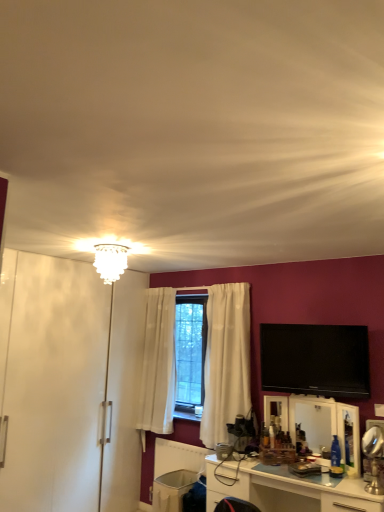
What do you see at coordinates (172, 490) in the screenshot?
I see `white plastic trash bin at lower center` at bounding box center [172, 490].

Describe the element at coordinates (327, 426) in the screenshot. I see `clear glass mirror at center` at that location.

The width and height of the screenshot is (384, 512). What are the coordinates of `clear glass mirror at center` in the screenshot? It's located at 327,426.

What do you see at coordinates (286, 489) in the screenshot? Image resolution: width=384 pixels, height=512 pixels. I see `white glossy cabinet at lower center` at bounding box center [286, 489].

This screenshot has width=384, height=512. I want to click on white glossy cabinet at lower center, so click(286, 489).

You are a GUI agent. You are given a task and a screenshot of the screen. Output one action in this format:
    pyautogui.click(x=<x>, y=<y>)
    Task: Click on the white glossy armoire at left
    
    Given the screenshot: What is the action you would take?
    pyautogui.click(x=54, y=386)

The height and width of the screenshot is (512, 384). What do you see at coordinates (315, 360) in the screenshot?
I see `flat screen tv at upper right` at bounding box center [315, 360].

Image resolution: width=384 pixels, height=512 pixels. What are the coordinates of `white plastic trash bin at lower center` in the screenshot? It's located at (172, 490).

From the picture: Which is more to the left, white glossy cabinet at lower center or flat screen tv at upper right?

From the viewer's perspective, white glossy cabinet at lower center appears more on the left side.

Is white glossy cabinet at lower center closer to the viewer compared to flat screen tv at upper right?

Yes, white glossy cabinet at lower center is closer to the camera.

In the scene shown: Is white glossy cabinet at lower center placed right next to flat screen tv at upper right?

white glossy cabinet at lower center and flat screen tv at upper right are clearly separated.

From the image's perspective, between white glossy cabinet at lower center and flat screen tv at upper right, who is located below?

white glossy cabinet at lower center appears lower in the image.

Consider the image. Can you confirm if white glass chandelier at upper center is positioned to the right of white glossy cabinet at lower center?

In fact, white glass chandelier at upper center is to the left of white glossy cabinet at lower center.

From a real-world perspective, which object stands above the other?

white glass chandelier at upper center.

Would you say white glossy cabinet at lower center is part of white glass chandelier at upper center's contents?

No, white glossy cabinet at lower center is not surrounded by white glass chandelier at upper center.

Who is taller, white glass chandelier at upper center or white glossy cabinet at lower center?

Standing taller between the two is white glossy cabinet at lower center.

Is clear glass mirror at center in front of or behind white glass chandelier at upper center in the image?

clear glass mirror at center is positioned closer to the viewer than white glass chandelier at upper center.

Looking at this image, between clear glass mirror at center and white glass chandelier at upper center, which one has less height?

With less height is white glass chandelier at upper center.

From a real-world perspective, is clear glass mirror at center under white glass chandelier at upper center?

Correct, in the physical world, clear glass mirror at center is lower than white glass chandelier at upper center.

Could you tell me if clear glass mirror at center is turned towards white glass chandelier at upper center?

No, clear glass mirror at center is not oriented towards white glass chandelier at upper center.

Is white glass chandelier at upper center far from clear glass mirror at center?

That's right, there is a large distance between white glass chandelier at upper center and clear glass mirror at center.

Considering the sizes of objects white glass chandelier at upper center and clear glass mirror at center in the image provided, who is bigger, white glass chandelier at upper center or clear glass mirror at center?

With larger size is clear glass mirror at center.

Which of these two, white glass chandelier at upper center or clear glass mirror at center, stands taller?

clear glass mirror at center.

Is white glass chandelier at upper center aimed at clear glass mirror at center?

No, white glass chandelier at upper center is not facing towards clear glass mirror at center.

This screenshot has height=512, width=384. In order to click on mirror below the white glossy armoire at left (from the image's perspective) in this screenshot , I will do `click(327, 426)`.

Considering the relative sizes of clear glass mirror at center and white glossy armoire at left in the image provided, is clear glass mirror at center taller than white glossy armoire at left?

In fact, clear glass mirror at center may be shorter than white glossy armoire at left.

From a real-world perspective, is clear glass mirror at center physically below white glossy armoire at left?

Yes, from a real-world perspective, clear glass mirror at center is below white glossy armoire at left.

Identify the location of lamp located above the white glossy armoire at left (from a real-world perspective). The width and height of the screenshot is (384, 512). (110, 261).

Which object is positioned more to the right, white glossy armoire at left or white glass chandelier at upper center?

white glass chandelier at upper center.

Between point (107, 498) and point (117, 258), which one is positioned behind?

Positioned behind is point (107, 498).

From the image's perspective, is white glossy armoire at left above or below white glass chandelier at upper center?

From the image's perspective, white glossy armoire at left appears below white glass chandelier at upper center.

Considering the relative sizes of flat screen tv at upper right and white glossy cabinet at lower center in the image provided, is flat screen tv at upper right shorter than white glossy cabinet at lower center?

Incorrect, the height of flat screen tv at upper right does not fall short of that of white glossy cabinet at lower center.

Would you say flat screen tv at upper right is inside or outside white glossy cabinet at lower center?

flat screen tv at upper right is spatially situated outside white glossy cabinet at lower center.

Considering the sizes of flat screen tv at upper right and white glossy cabinet at lower center in the image, is flat screen tv at upper right wider or thinner than white glossy cabinet at lower center?

Considering their sizes, flat screen tv at upper right looks slimmer than white glossy cabinet at lower center.

Find the location of `television above the white glossy cabinet at lower center (from a real-world perspective)`. television above the white glossy cabinet at lower center (from a real-world perspective) is located at coordinates (315, 360).

This screenshot has width=384, height=512. Identify the location of cabinetry that is below the white glass chandelier at upper center (from the image's perspective). (286, 489).

From the image, which object appears to be nearer to flat screen tv at upper right, white glossy armoire at left or white glossy cabinet at lower center?

Among the two, white glossy cabinet at lower center is located nearer to flat screen tv at upper right.

Considering their positions, is white glossy armoire at left positioned closer to white glass chandelier at upper center than clear glass mirror at center?

white glossy armoire at left is positioned closer to the anchor white glass chandelier at upper center.

Looking at the image, which one is located closer to white plastic trash bin at lower center, white glossy cabinet at lower center or white glass chandelier at upper center?

Based on the image, white glossy cabinet at lower center appears to be nearer to white plastic trash bin at lower center.

From the image, which object appears to be farther from clear glass mirror at center, white plastic trash bin at lower center or white glossy armoire at left?

white glossy armoire at left.

From the image, which object appears to be farther from clear glass mirror at center, white glass chandelier at upper center or white glossy cabinet at lower center?

white glass chandelier at upper center lies further to clear glass mirror at center than the other object.

Which object lies nearer to the anchor point white plastic trash bin at lower center, clear glass mirror at center or white glass chandelier at upper center?

Among the two, clear glass mirror at center is located nearer to white plastic trash bin at lower center.

Considering their positions, is white glossy cabinet at lower center positioned further to white glossy armoire at left than white glass chandelier at upper center?

Based on the image, white glossy cabinet at lower center appears to be further to white glossy armoire at left.

Considering their positions, is clear glass mirror at center positioned further to white glass chandelier at upper center than white glossy cabinet at lower center?

Based on the image, clear glass mirror at center appears to be further to white glass chandelier at upper center.

Find the location of a particular element. The image size is (384, 512). television that lies between white glass chandelier at upper center and white glossy cabinet at lower center from top to bottom is located at coordinates tap(315, 360).

You are a GUI agent. You are given a task and a screenshot of the screen. Output one action in this format:
    pyautogui.click(x=<x>, y=<y>)
    Task: Click on the armoire between white glass chandelier at upper center and white plastic trash bin at lower center vertically
    This screenshot has height=512, width=384.
    Given the screenshot: What is the action you would take?
    pyautogui.click(x=54, y=386)

At what (x,y) coordinates should I click in order to perform the action: click on mirror between white glass chandelier at upper center and white glossy cabinet at lower center in the vertical direction. Please return your answer as a coordinate pair (x, y). Image resolution: width=384 pixels, height=512 pixels. Looking at the image, I should click on (327, 426).

The height and width of the screenshot is (512, 384). I want to click on cabinetry situated between white glossy armoire at left and flat screen tv at upper right from left to right, so click(x=286, y=489).